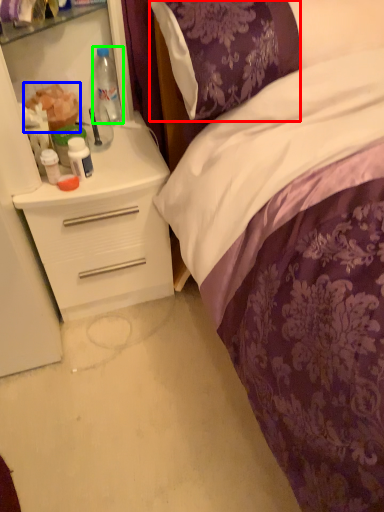
Question: Which is nearer to the pillow (highlighted by a red box)? food (highlighted by a blue box) or bottle (highlighted by a green box).

Choices:
 (A) food
 (B) bottle

Answer: (B)